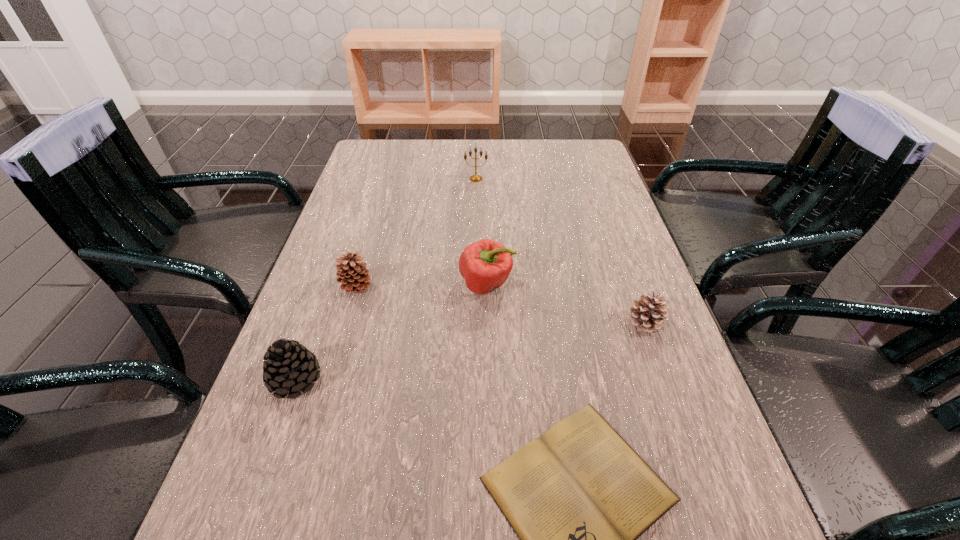
I want to click on vacant area in the image that satisfies the following two spatial constraints: 1. on the back side of the bell pepper; 2. on the right side of the farthest pinecone, so click(357, 285).

Where is `vacant region that satisfies the following two spatial constraints: 1. on the front side of the farthest object; 2. on the right side of the rightmost pinecone`? The width and height of the screenshot is (960, 540). vacant region that satisfies the following two spatial constraints: 1. on the front side of the farthest object; 2. on the right side of the rightmost pinecone is located at coordinates click(x=474, y=322).

Locate an element on the screen. vacant position in the image that satisfies the following two spatial constraints: 1. on the front side of the farthest object; 2. on the left side of the shortest pinecone is located at coordinates 474,322.